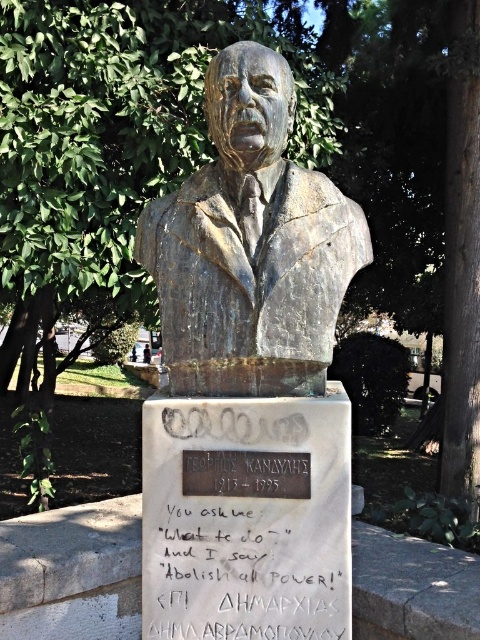
Is bronze bust at center further to camera compared to handwritten text at center?

No.

Which is in front, point (228, 220) or point (283, 625)?

Point (283, 625) is more forward.

Between point (171, 282) and point (251, 611), which one is positioned behind?

The point (171, 282) is behind.

You are a GUI agent. You are given a task and a screenshot of the screen. Output one action in this format:
    pyautogui.click(x=<x>, y=<y>)
    Task: Click on the bronze bust at center
    The image size is (480, 640).
    Given the screenshot: What is the action you would take?
    pyautogui.click(x=251, y=246)

Is handwritten text at center in front of bronze plaque at center?

Yes, it is in front of bronze plaque at center.

Who is more distant from viewer, (285, 499) or (207, 481)?

Point (207, 481)

Where is `handwritten text at center`? Image resolution: width=480 pixels, height=640 pixels. handwritten text at center is located at coordinates (245, 568).

Is bronze bust at center closer to camera compared to bronze plaque at center?

That is True.

Can you confirm if bronze bust at center is positioned to the right of bronze plaque at center?

Yes, bronze bust at center is to the right of bronze plaque at center.

Which is in front, point (210, 196) or point (226, 477)?

Point (226, 477)

At what (x,y) coordinates should I click in order to perform the action: click on bronze bust at center. Please return your answer as a coordinate pair (x, y). This screenshot has width=480, height=640. Looking at the image, I should click on (251, 246).